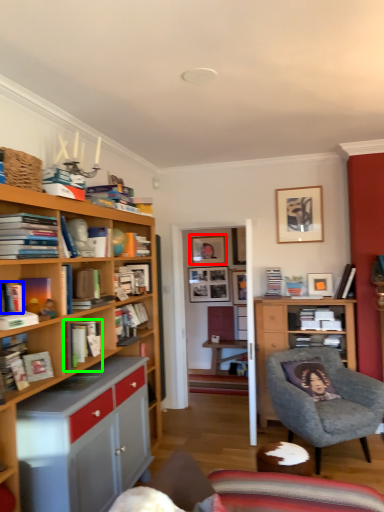
Question: Which object is the closest to the picture frame (highlighted by a red box)? Choose among these: book (highlighted by a blue box) or book (highlighted by a green box).

Choices:
 (A) book
 (B) book

Answer: (B)